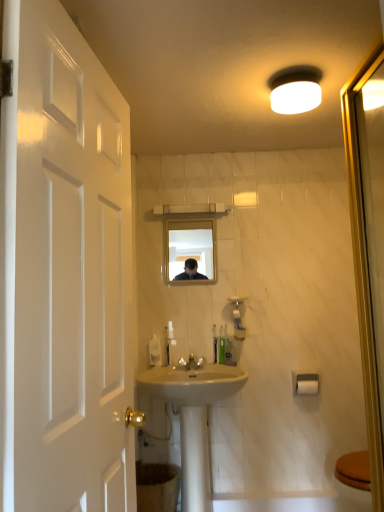
Where is `vacant space to the left of green plastic toothbrush at center`? This screenshot has height=512, width=384. vacant space to the left of green plastic toothbrush at center is located at coordinates (188, 369).